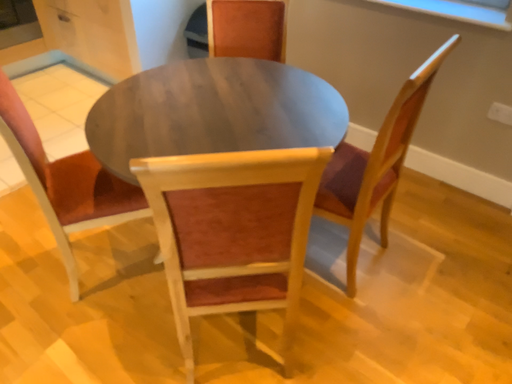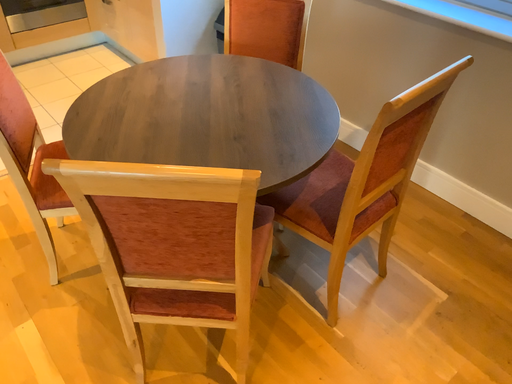
Question: How did the camera likely rotate when shooting the video?

Choices:
 (A) rotated left
 (B) rotated right

Answer: (A)